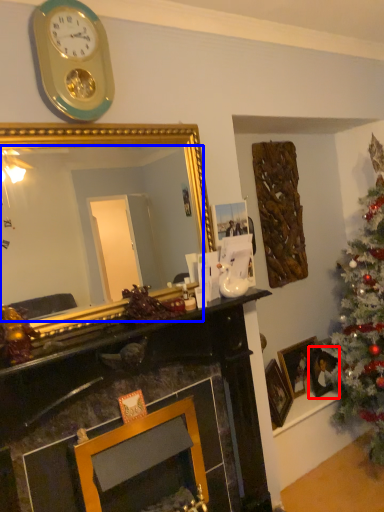
Question: Which object is further to the camera taking this photo, picture frame (highlighted by a red box) or mirror (highlighted by a blue box)?

Choices:
 (A) picture frame
 (B) mirror

Answer: (A)